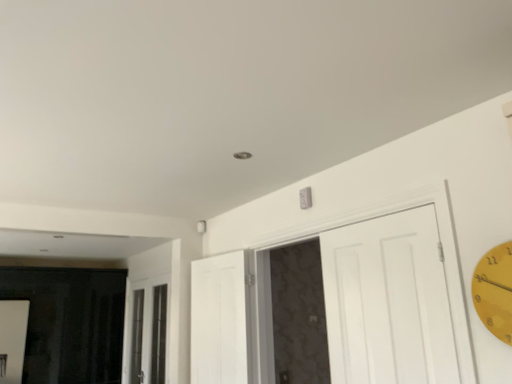
Question: Is clear glass window at center inside or outside of white matte door at upper center, the 2th door from the left?

Choices:
 (A) outside
 (B) inside

Answer: (A)

Question: Is point (155, 352) positioned closer to the camera than point (390, 352)?

Choices:
 (A) closer
 (B) farther

Answer: (B)

Question: Considering the real-world distances, which object is closest to the white matte door at upper center, the 1th door viewed from the right?

Choices:
 (A) yellow matte clock at right
 (B) white wood door at center, which ranks as the 1th door in left-to-right order
 (C) clear glass window at center

Answer: (B)

Question: Considering the real-world distances, which object is closest to the white matte door at upper center, the 2th door from the left?

Choices:
 (A) clear glass window at center
 (B) yellow matte clock at right
 (C) white wood door at center, the 2th door positioned from the right

Answer: (C)